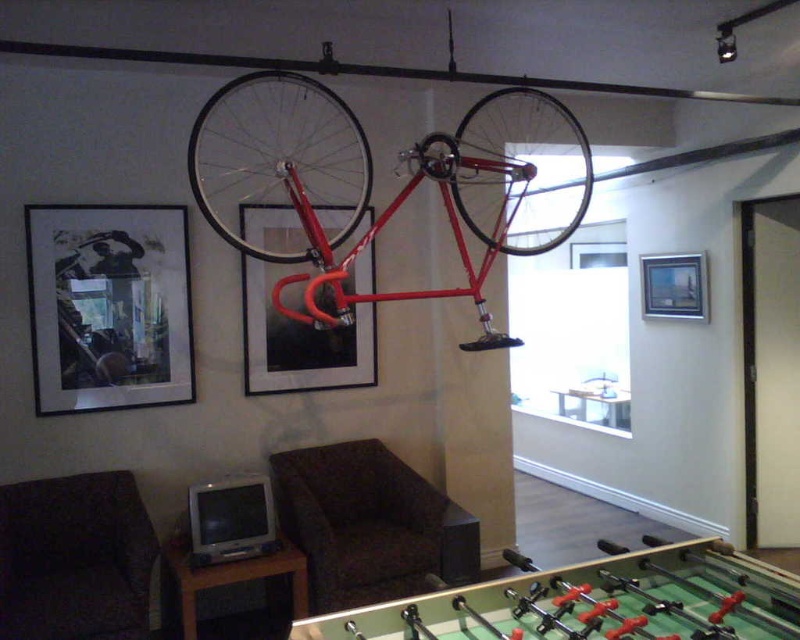
In the scene shown: Does matte black picture frame at center have a lesser width compared to wooden picture frame at upper right?

In fact, matte black picture frame at center might be wider than wooden picture frame at upper right.

Between matte black picture frame at center and wooden picture frame at upper right, which one has less height?

wooden picture frame at upper right is shorter.

Does point (372, 276) lie behind point (702, 268)?

No.

At what (x,y) coordinates should I click in order to perform the action: click on matte black picture frame at center. Please return your answer as a coordinate pair (x, y). The image size is (800, 640). Looking at the image, I should click on (300, 340).

Does matte black picture frame at upper left appear on the right side of matte black picture frame at center?

No, matte black picture frame at upper left is not to the right of matte black picture frame at center.

Which is behind, point (69, 280) or point (249, 323)?

The point (249, 323) is behind.

The width and height of the screenshot is (800, 640). In order to click on matte black picture frame at upper left in this screenshot , I will do `click(108, 307)`.

Who is more forward, (x=216, y=136) or (x=60, y=236)?

Positioned in front is point (x=60, y=236).

Consider the image. Who is more distant from viewer, [462,349] or [116,356]?

Point [462,349]

Identify the location of shiny red bicycle at upper center. The image size is (800, 640). (372, 179).